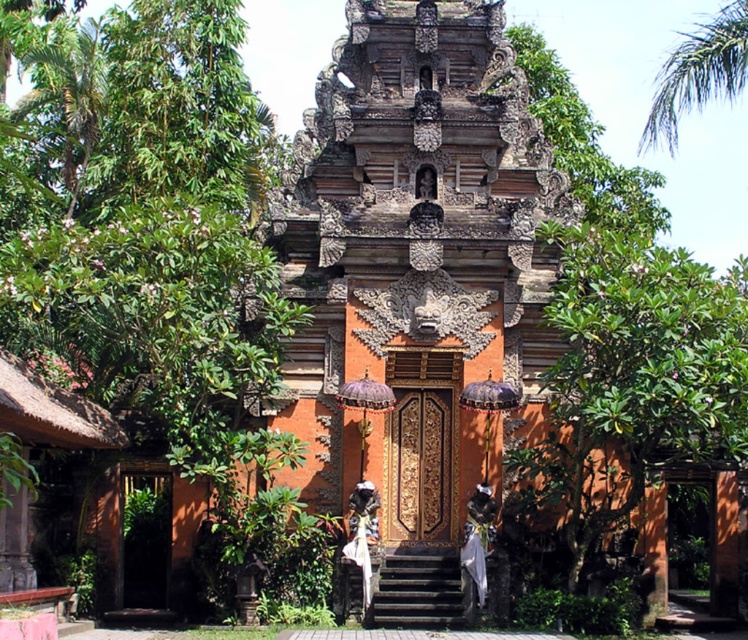
Can you confirm if terracotta stone temple at center is wider than green leafy tree at center?

Yes, terracotta stone temple at center is wider than green leafy tree at center.

The height and width of the screenshot is (640, 748). What do you see at coordinates (414, 278) in the screenshot? I see `terracotta stone temple at center` at bounding box center [414, 278].

Is point (508, 321) closer to camera compared to point (586, 428)?

That is False.

Find the location of a particular element. The image size is (748, 640). terracotta stone temple at center is located at coordinates (414, 278).

Which is behind, point (729, 461) or point (361, 492)?

The point (729, 461) is behind.

Who is lower down, green leafy tree at center or white cloth at center?

Positioned lower is white cloth at center.

Measure the distance between point (744, 404) and camera.

Point (744, 404) is 57.26 meters from camera.

Where is `green leafy tree at center`? The width and height of the screenshot is (748, 640). green leafy tree at center is located at coordinates (634, 378).

Can you confirm if terracotta stone temple at center is positioned to the right of white cloth at center?

Yes, terracotta stone temple at center is to the right of white cloth at center.

Which is above, terracotta stone temple at center or white cloth at center?

terracotta stone temple at center is higher up.

Identify the location of terracotta stone temple at center. Image resolution: width=748 pixels, height=640 pixels. (414, 278).

Where is `terracotta stone temple at center`? terracotta stone temple at center is located at coordinates (414, 278).